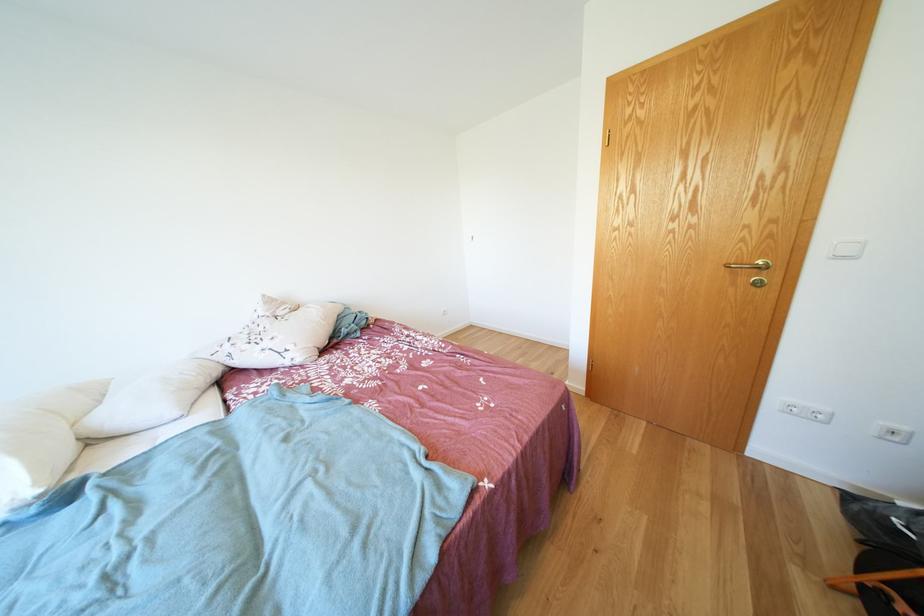
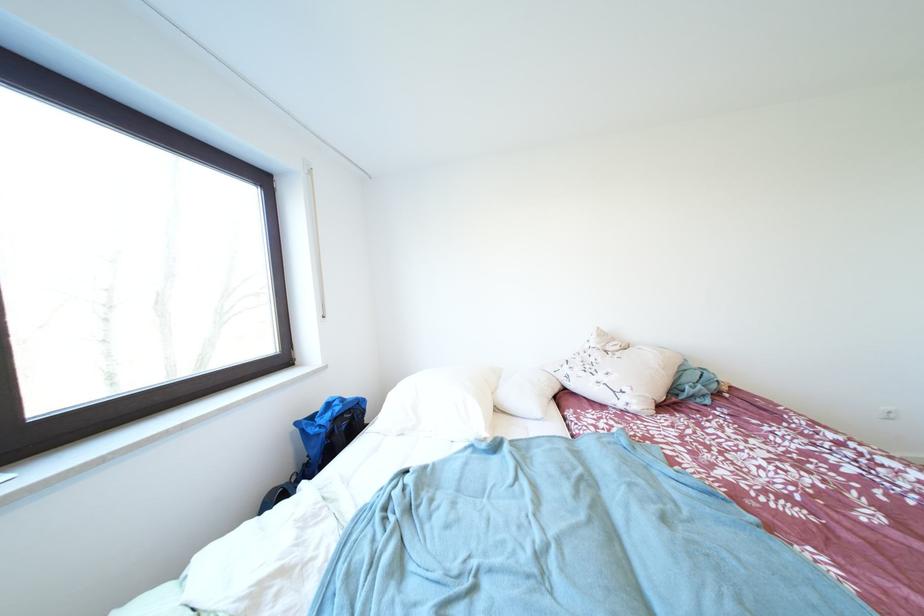
In the second image, find the point that corresponds to (453,314) in the first image.

(895, 413)